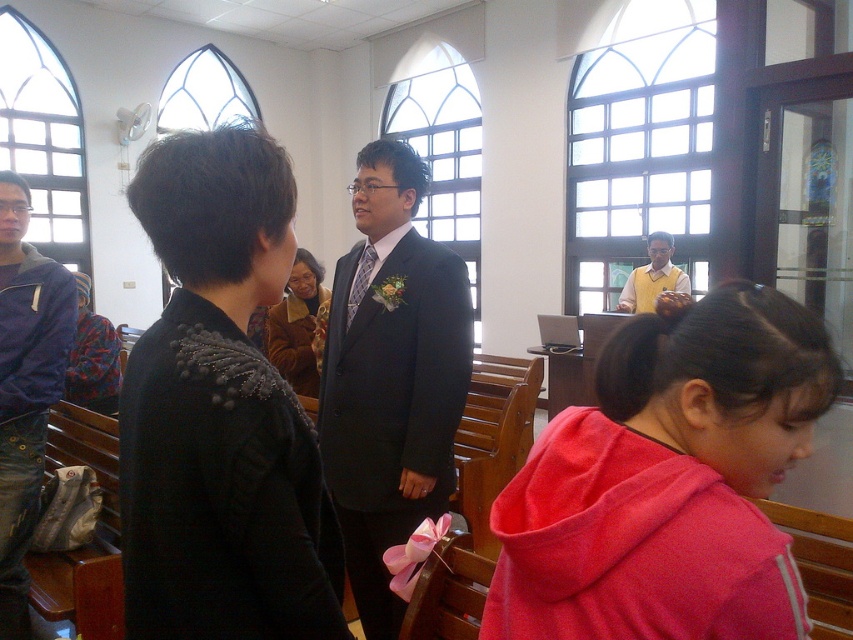
Question: Can you confirm if matte black suit at center is positioned to the left of brushed metal jacket at left?

Choices:
 (A) yes
 (B) no

Answer: (B)

Question: Which object is the farthest from the matte black suit at center?

Choices:
 (A) floral-patterned fabric at center
 (B) yellow matte vest at center

Answer: (B)

Question: Does brushed metal jacket at left come in front of floral-patterned fabric at center?

Choices:
 (A) yes
 (B) no

Answer: (A)

Question: Can you confirm if brushed metal jacket at left is positioned below yellow matte vest at center?

Choices:
 (A) yes
 (B) no

Answer: (A)

Question: Which object is farther from the camera taking this photo?

Choices:
 (A) brushed metal jacket at left
 (B) brown textured coat at center
 (C) pink fleece at lower right

Answer: (B)

Question: Which object is positioned closest to the matte black suit at center?

Choices:
 (A) floral-patterned fabric at center
 (B) pink fleece at lower right
 (C) yellow matte vest at center
 (D) brushed metal jacket at left

Answer: (D)